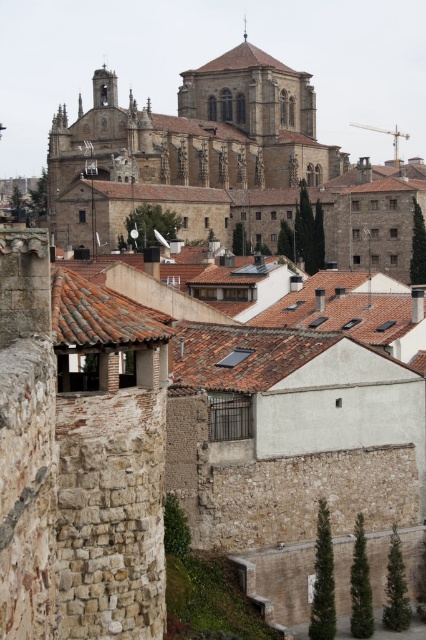
Looking at this image, who is positioned more to the left, brown stone church at upper center or terracotta tile roof at center?

From the viewer's perspective, terracotta tile roof at center appears more on the left side.

Does point (206, 64) come farther from viewer compared to point (69, 323)?

Yes, it is.

At what (x,y) coordinates should I click in order to perform the action: click on brown stone church at upper center. Please return your answer as a coordinate pair (x, y). The image size is (426, 640). Looking at the image, I should click on coord(230,161).